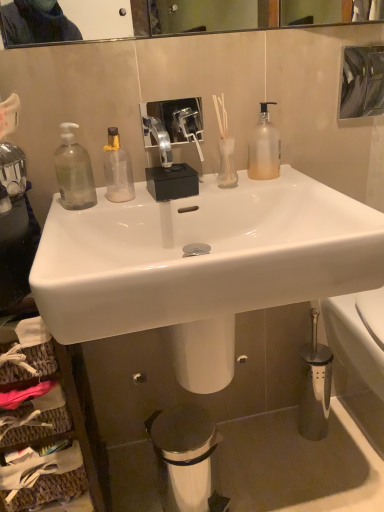
Question: From the image's perspective, is woven wood cabinet at lower left below white glossy toilet at lower right?

Choices:
 (A) yes
 (B) no

Answer: (A)

Question: Is the depth of woven wood cabinet at lower left greater than that of white glossy toilet at lower right?

Choices:
 (A) yes
 (B) no

Answer: (B)

Question: Is the position of woven wood cabinet at lower left less distant than that of white glossy toilet at lower right?

Choices:
 (A) no
 (B) yes

Answer: (B)

Question: Considering the relative sizes of woven wood cabinet at lower left and white glossy toilet at lower right in the image provided, is woven wood cabinet at lower left bigger than white glossy toilet at lower right?

Choices:
 (A) yes
 (B) no

Answer: (A)

Question: Is woven wood cabinet at lower left oriented away from white glossy toilet at lower right?

Choices:
 (A) yes
 (B) no

Answer: (B)

Question: Is woven wood cabinet at lower left to the right of white glossy toilet at lower right from the viewer's perspective?

Choices:
 (A) no
 (B) yes

Answer: (A)

Question: Can you confirm if white glossy toilet at lower right is bigger than metallic trash can at lower center?

Choices:
 (A) no
 (B) yes

Answer: (B)

Question: Is white glossy toilet at lower right turned away from metallic trash can at lower center?

Choices:
 (A) no
 (B) yes

Answer: (A)

Question: Can you confirm if white glossy toilet at lower right is thinner than metallic trash can at lower center?

Choices:
 (A) no
 (B) yes

Answer: (A)

Question: Is white glossy toilet at lower right wider than metallic trash can at lower center?

Choices:
 (A) yes
 (B) no

Answer: (A)

Question: From the image's perspective, is white glossy toilet at lower right located beneath metallic trash can at lower center?

Choices:
 (A) yes
 (B) no

Answer: (B)

Question: Is white glossy toilet at lower right to the left of metallic trash can at lower center from the viewer's perspective?

Choices:
 (A) yes
 (B) no

Answer: (B)

Question: Does frosted glass pump bottle at upper right, which is counted as the 3th bottle, starting from the left, appear on the right side of white glossy sink at center?

Choices:
 (A) no
 (B) yes

Answer: (B)